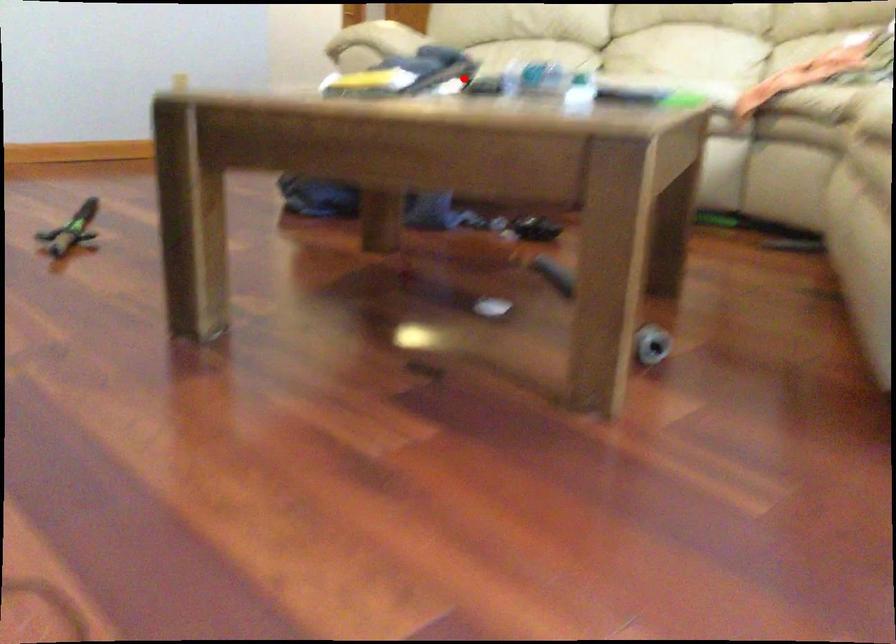
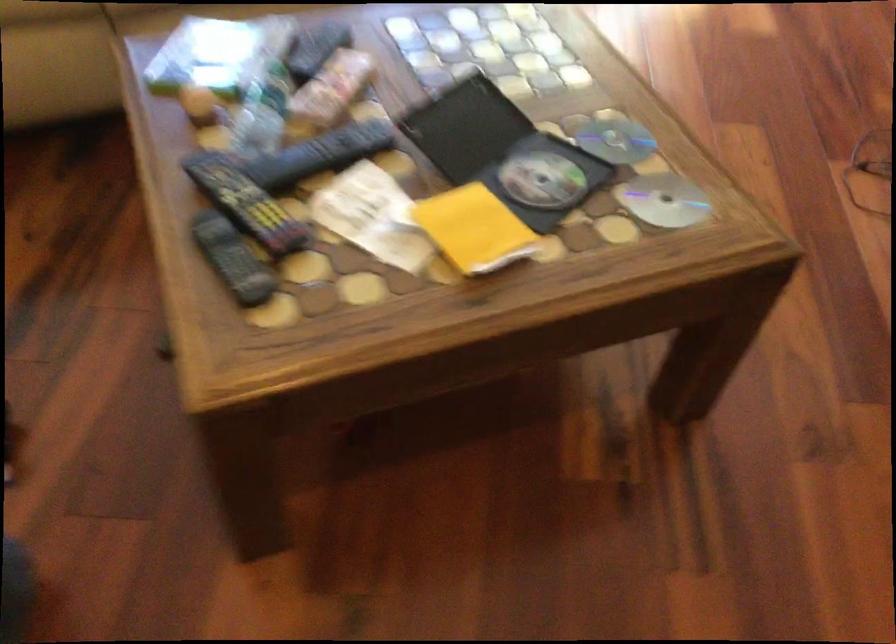
Where in the second image is the point corresponding to the highlighted location from the first image?

(245, 202)